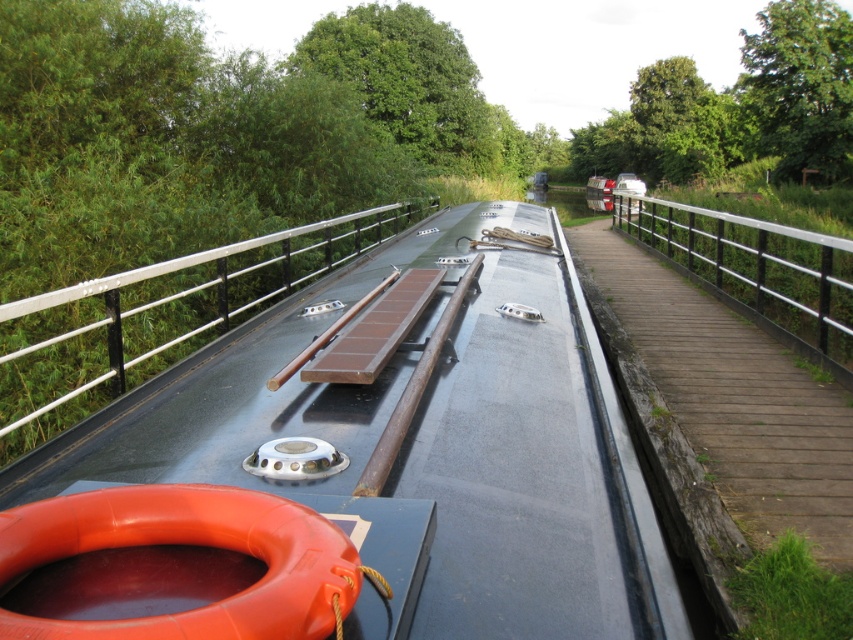
Which of these two, metallic gray boat at center or silver metallic rail at right, stands shorter?

metallic gray boat at center

Looking at this image, which of these two, metallic gray boat at center or silver metallic rail at right, stands taller?

With more height is silver metallic rail at right.

What do you see at coordinates (355, 476) in the screenshot? I see `metallic gray boat at center` at bounding box center [355, 476].

In order to click on metallic gray boat at center in this screenshot , I will do `click(355, 476)`.

Can you confirm if metallic gray boat at center is positioned below silver metallic rail at center?

No.

Looking at this image, is metallic gray boat at center above silver metallic rail at center?

Correct, metallic gray boat at center is located above silver metallic rail at center.

Locate an element on the screen. The image size is (853, 640). metallic gray boat at center is located at coordinates (355, 476).

In order to click on metallic gray boat at center in this screenshot , I will do `click(355, 476)`.

Who is positioned more to the left, silver metallic rail at center or silver metallic rail at right?

From the viewer's perspective, silver metallic rail at center appears more on the left side.

What do you see at coordinates (158, 323) in the screenshot? I see `silver metallic rail at center` at bounding box center [158, 323].

Does point (218, 280) come closer to viewer compared to point (633, 211)?

Yes.

Find the location of a particular element. The height and width of the screenshot is (640, 853). silver metallic rail at center is located at coordinates (158, 323).